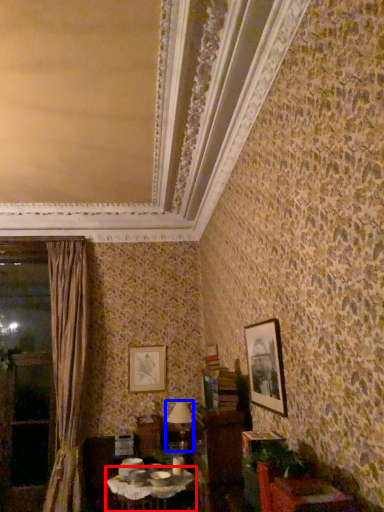
Question: Which of the following is the closest to the observer, table (highlighted by a red box) or table lamp (highlighted by a blue box)?

Choices:
 (A) table
 (B) table lamp

Answer: (A)